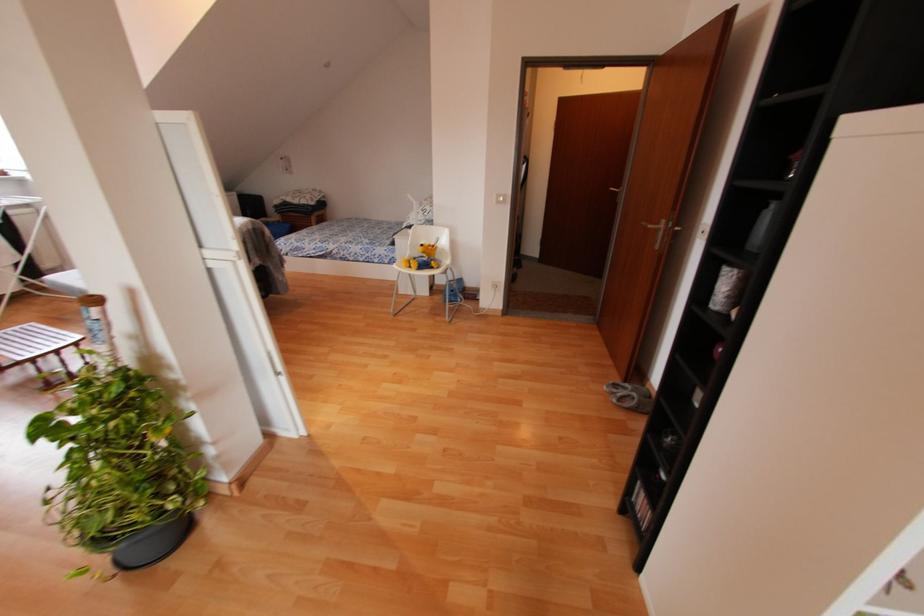
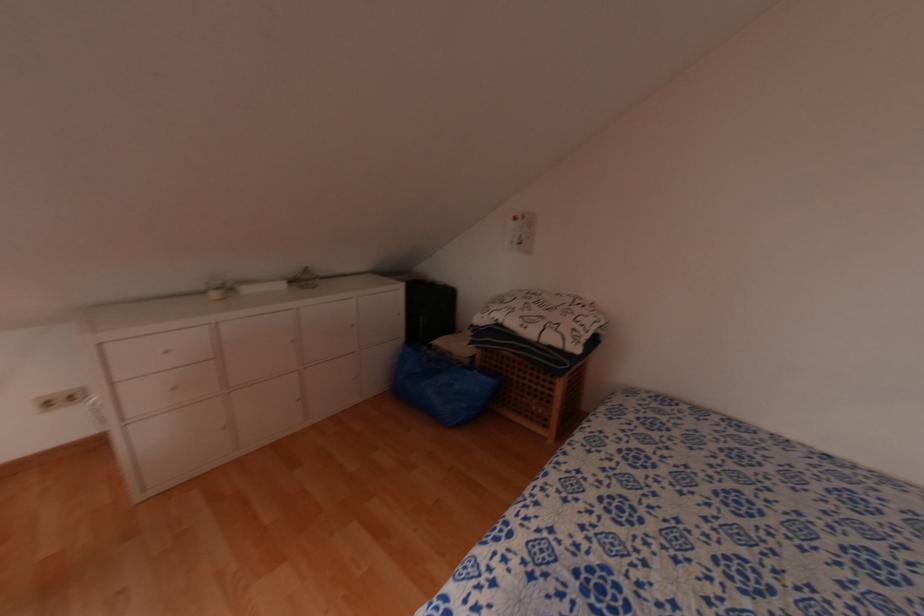
In the second image, find the point that corresponds to point (310, 222) in the first image.

(552, 384)